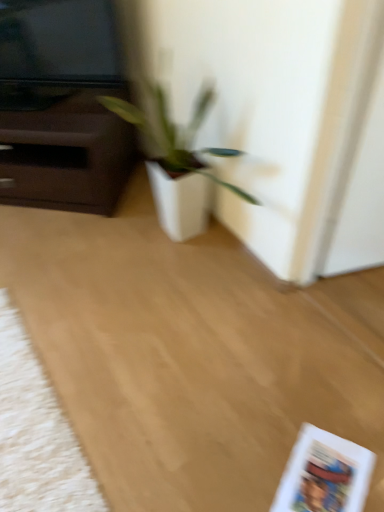
Question: Should I look upward or downward to see white matte plant pot at center?

Choices:
 (A) up
 (B) down

Answer: (B)

Question: Is there a large distance between white fluffy mat at lower left and white matte pot at center?

Choices:
 (A) yes
 (B) no

Answer: (B)

Question: Could you tell me if white fluffy mat at lower left is facing white matte pot at center?

Choices:
 (A) yes
 (B) no

Answer: (B)

Question: From a real-world perspective, is white fluffy mat at lower left under white matte pot at center?

Choices:
 (A) yes
 (B) no

Answer: (A)

Question: From the image's perspective, is white fluffy mat at lower left below white matte pot at center?

Choices:
 (A) yes
 (B) no

Answer: (A)

Question: From the image's perspective, would you say white fluffy mat at lower left is positioned over white matte pot at center?

Choices:
 (A) yes
 (B) no

Answer: (B)

Question: Does white fluffy mat at lower left have a greater height compared to white matte pot at center?

Choices:
 (A) yes
 (B) no

Answer: (B)

Question: Would you say white matte pot at center is a long distance from white fluffy mat at lower left?

Choices:
 (A) yes
 (B) no

Answer: (B)

Question: Can you see white matte pot at center touching white fluffy mat at lower left?

Choices:
 (A) yes
 (B) no

Answer: (B)

Question: Can you confirm if white matte pot at center is positioned to the right of white fluffy mat at lower left?

Choices:
 (A) no
 (B) yes

Answer: (B)

Question: Is white matte pot at center wider than white fluffy mat at lower left?

Choices:
 (A) yes
 (B) no

Answer: (B)

Question: From the image's perspective, is white matte pot at center located beneath white fluffy mat at lower left?

Choices:
 (A) yes
 (B) no

Answer: (B)

Question: From the image's perspective, is white matte pot at center on top of white fluffy mat at lower left?

Choices:
 (A) yes
 (B) no

Answer: (A)

Question: Is white fluffy mat at lower left smaller than white matte paperback book at lower right?

Choices:
 (A) no
 (B) yes

Answer: (A)